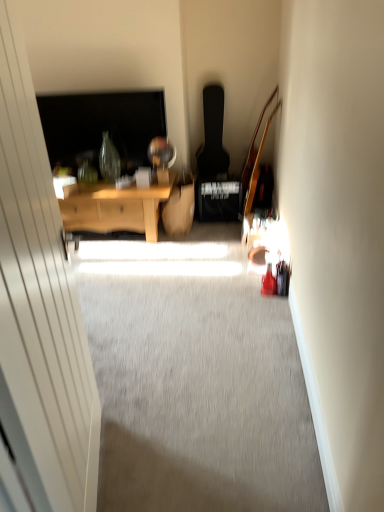
Question: Does wooden desk at center have a smaller size compared to transparent glass door at left?

Choices:
 (A) yes
 (B) no

Answer: (B)

Question: From the image's perspective, is wooden desk at center below transparent glass door at left?

Choices:
 (A) yes
 (B) no

Answer: (B)

Question: Is wooden desk at center oriented away from transparent glass door at left?

Choices:
 (A) no
 (B) yes

Answer: (A)

Question: Considering the relative positions of wooden desk at center and transparent glass door at left in the image provided, is wooden desk at center to the left of transparent glass door at left from the viewer's perspective?

Choices:
 (A) no
 (B) yes

Answer: (B)

Question: Considering the relative positions of wooden desk at center and transparent glass door at left in the image provided, is wooden desk at center behind transparent glass door at left?

Choices:
 (A) yes
 (B) no

Answer: (A)

Question: Is wooden desk at center positioned beyond the bounds of transparent glass door at left?

Choices:
 (A) yes
 (B) no

Answer: (A)

Question: From the image's perspective, is transparent glass door at left beneath wooden desk at center?

Choices:
 (A) yes
 (B) no

Answer: (A)

Question: Can you confirm if transparent glass door at left is smaller than wooden desk at center?

Choices:
 (A) no
 (B) yes

Answer: (B)

Question: Is transparent glass door at left positioned in front of wooden desk at center?

Choices:
 (A) yes
 (B) no

Answer: (A)

Question: Would you say wooden desk at center is part of transparent glass door at left's contents?

Choices:
 (A) yes
 (B) no

Answer: (B)

Question: Could you tell me if transparent glass door at left is turned towards wooden desk at center?

Choices:
 (A) yes
 (B) no

Answer: (B)

Question: Does transparent glass door at left appear on the right side of wooden desk at center?

Choices:
 (A) yes
 (B) no

Answer: (A)

Question: From a real-world perspective, is transparent glass door at left positioned above or below wooden desk at center?

Choices:
 (A) above
 (B) below

Answer: (A)